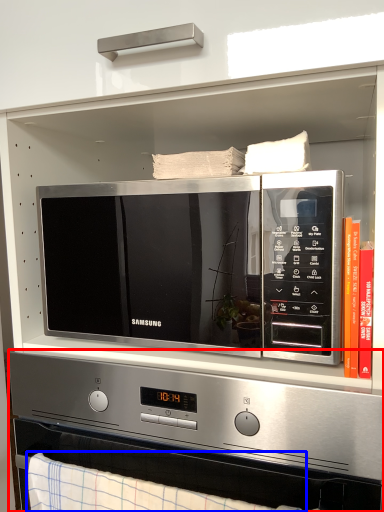
Question: Which of the following is the closest to the observer, appliance (highlighted by a red box) or blanket (highlighted by a blue box)?

Choices:
 (A) appliance
 (B) blanket

Answer: (B)